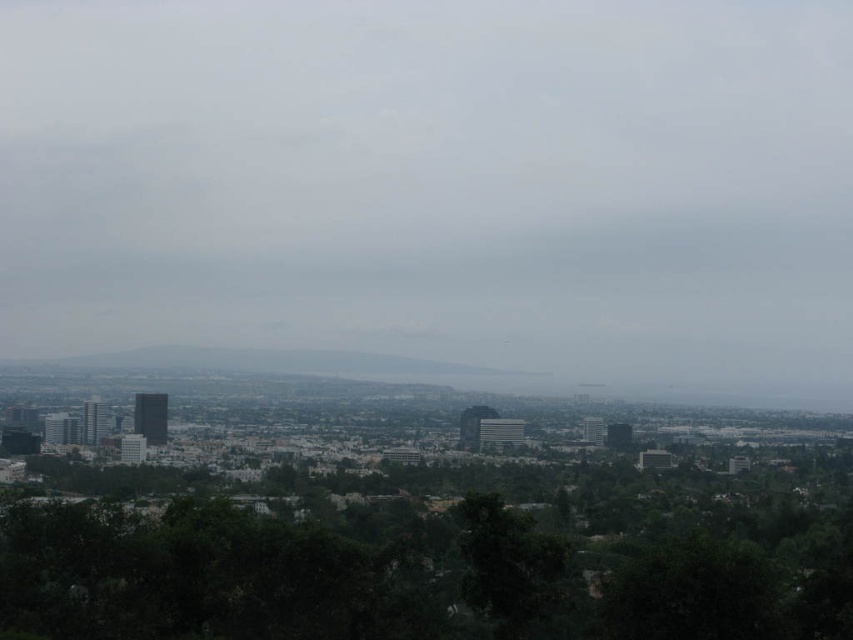
In the scene shown: You are an urban planner reviewing this cityscape. You notice the gray matte cloud at center and the green leafy tree at lower center. Which object is positioned higher in the sky?

The gray matte cloud at center is positioned higher in the sky than the green leafy tree at lower center.

You are an urban planner analyzing the cityscape. You notice the gray matte cloud at center and the green leafy tree at lower center. Which object appears larger in the image?

The green leafy tree at lower center appears larger than the gray matte cloud at center because the gray matte cloud at center has a smaller size compared to green leafy tree at lower center.

You are standing at the point with coordinates point (x=45, y=509) and want to walk to point (x=440, y=348). Given the cityscape described, will the dense clusters of greenery in the foreground block your direct path?

Point (x=440, y=348) is behind point (x=45, y=509), so the dense clusters of greenery in the foreground may block your direct path to point (x=440, y=348) since it is further back in the scene.